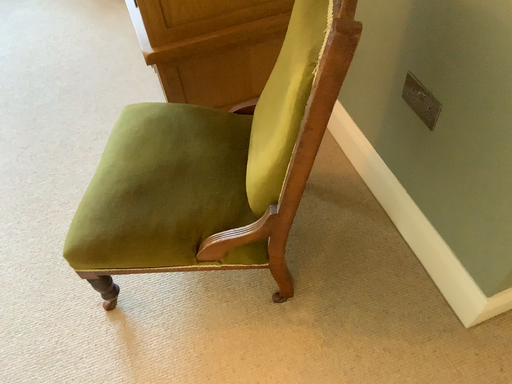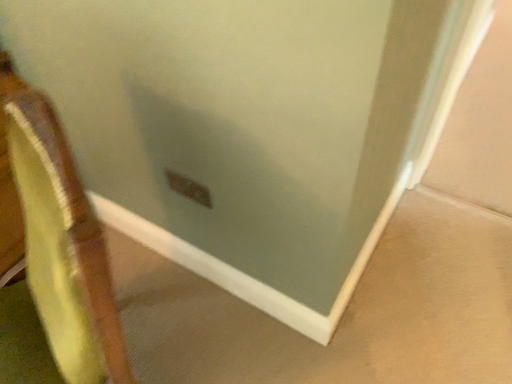
Question: Which way did the camera rotate in the video?

Choices:
 (A) rotated right
 (B) rotated left

Answer: (A)